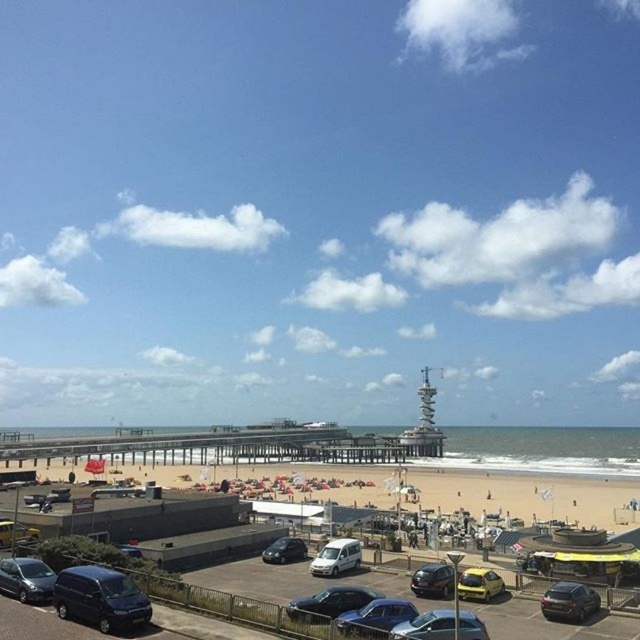
You are a photographer trying to capture a photo of the beach scene. You need to position yourself so that the shiny blue car at lower center and the shiny black car at lower center are both visible in the frame. Which car should you position yourself closer to in order to include both cars in the shot?

You should position yourself closer to the shiny blue car at lower center because it is to the left of the shiny black car at lower center, allowing both to be captured in the frame when centered.

You are a delivery person who needs to park your vehicle in the parking area near the beach. Your vehicle is 5 meters long. You see the shiny black van at lower left and the yellow matte car at lower center. Can you safely park your vehicle between them without overlapping either?

The distance between the shiny black van at lower left and the yellow matte car at lower center is 15.59 meters. Since your vehicle is only 5 meters long, there is enough space to park between them safely without overlapping either vehicle.

You are a lifeguard trying to set up a new lifeguard chair in the parking area. The space available between the shiny black van at lower left and the yellow matte car at lower center is exactly 1.2 meters. Can you fit a standard lifeguard chair that is 1 meter wide into this space?

The space between the shiny black van at lower left and the yellow matte car at lower center is 1.2 meters. Since the lifeguard chair is 1 meter wide, it should fit with some room to spare.